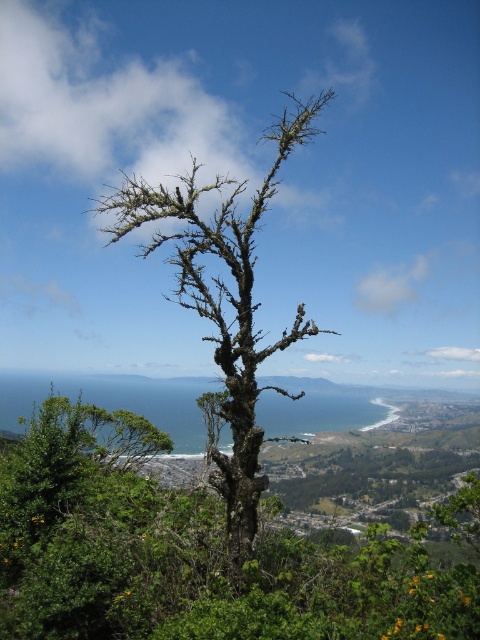
Question: Which point is farther from the camera taking this photo?

Choices:
 (A) (297, 394)
 (B) (137, 554)

Answer: (B)

Question: Can you confirm if green mossy tree at center is positioned to the left of dark brown bark tree at center?

Choices:
 (A) no
 (B) yes

Answer: (A)

Question: Where is green mossy tree at center located in relation to dark brown bark tree at center in the image?

Choices:
 (A) below
 (B) above

Answer: (A)

Question: Does green mossy tree at center have a greater width compared to dark brown bark tree at center?

Choices:
 (A) no
 (B) yes

Answer: (A)